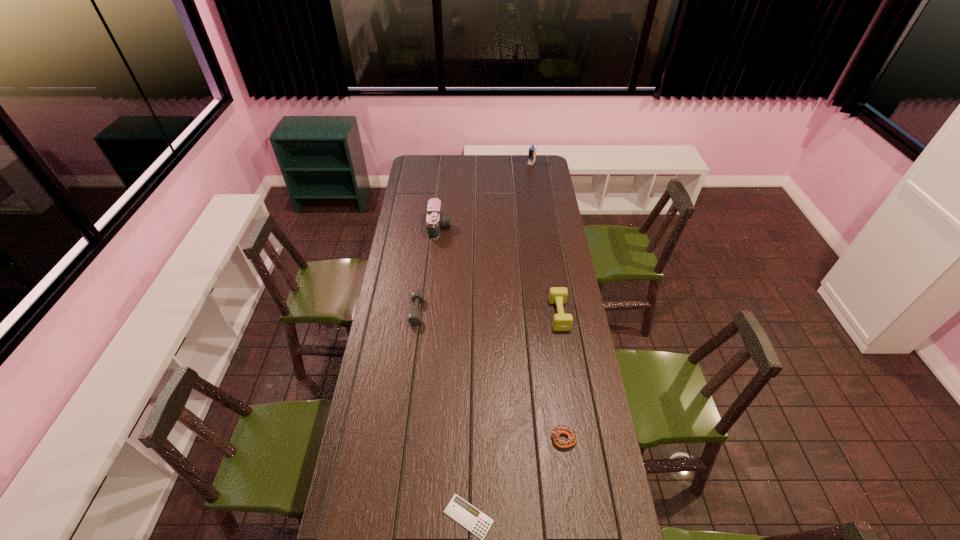
The width and height of the screenshot is (960, 540). Identify the location of free space at the left edge of the desktop. (391, 265).

Identify the location of free point at the right edge. The height and width of the screenshot is (540, 960). (590, 433).

Identify the location of free space between the third shortest object and the fifth tallest object. (491, 375).

Find the location of a particular element. The height and width of the screenshot is (540, 960). blank region between the farthest object and the third shortest object is located at coordinates (474, 237).

I want to click on vacant area between the farthest object and the doughnut, so click(x=547, y=300).

The height and width of the screenshot is (540, 960). I want to click on free space between the second farthest object and the farthest object, so click(486, 195).

This screenshot has height=540, width=960. What are the coordinates of `empty location between the taller dumbbell and the camera` in the screenshot? It's located at 499,271.

Locate an element on the screen. The width and height of the screenshot is (960, 540). vacant region between the doughnut and the farthest object is located at coordinates (547, 300).

Image resolution: width=960 pixels, height=540 pixels. I want to click on free space between the doughnut and the orange_juice, so click(x=547, y=300).

You are a GUI agent. You are given a task and a screenshot of the screen. Output one action in this format:
    pyautogui.click(x=<x>, y=<y>)
    Task: Click on the free spot between the right dumbbell and the farthest object
    Image resolution: width=960 pixels, height=540 pixels.
    Given the screenshot: What is the action you would take?
    pyautogui.click(x=545, y=239)